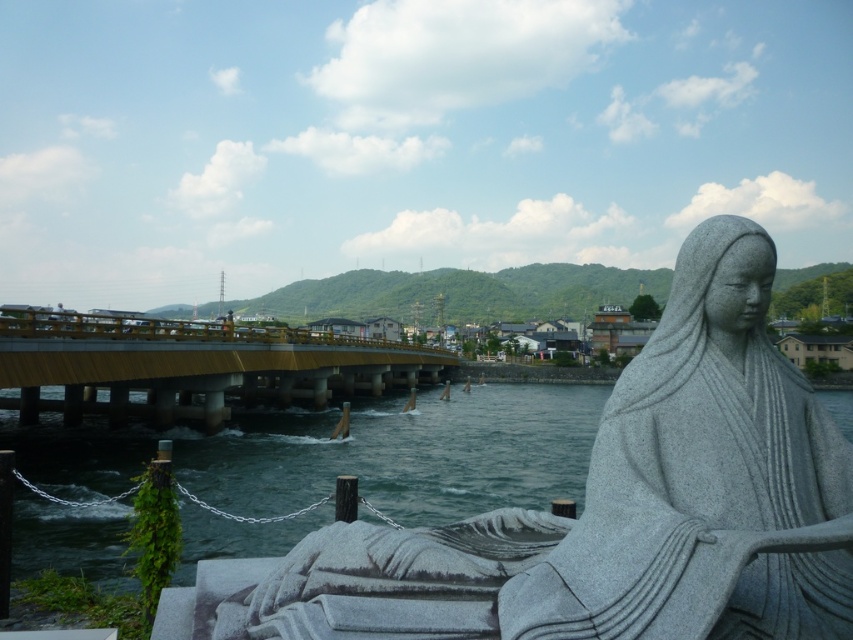
Question: Does granite statue at center have a greater width compared to dark blue water at center?

Choices:
 (A) yes
 (B) no

Answer: (B)

Question: Can you confirm if dark blue water at center is smaller than yellow metallic bridge at center?

Choices:
 (A) yes
 (B) no

Answer: (B)

Question: Which is farther from the granite statue at center?

Choices:
 (A) yellow metallic bridge at center
 (B) dark blue water at center

Answer: (A)

Question: Which of the following is the closest to the observer?

Choices:
 (A) dark blue water at center
 (B) yellow metallic bridge at center

Answer: (A)

Question: Among these objects, which one is nearest to the camera?

Choices:
 (A) yellow metallic bridge at center
 (B) granite statue at center
 (C) dark blue water at center

Answer: (B)

Question: Can you confirm if dark blue water at center is positioned below yellow metallic bridge at center?

Choices:
 (A) no
 (B) yes

Answer: (B)